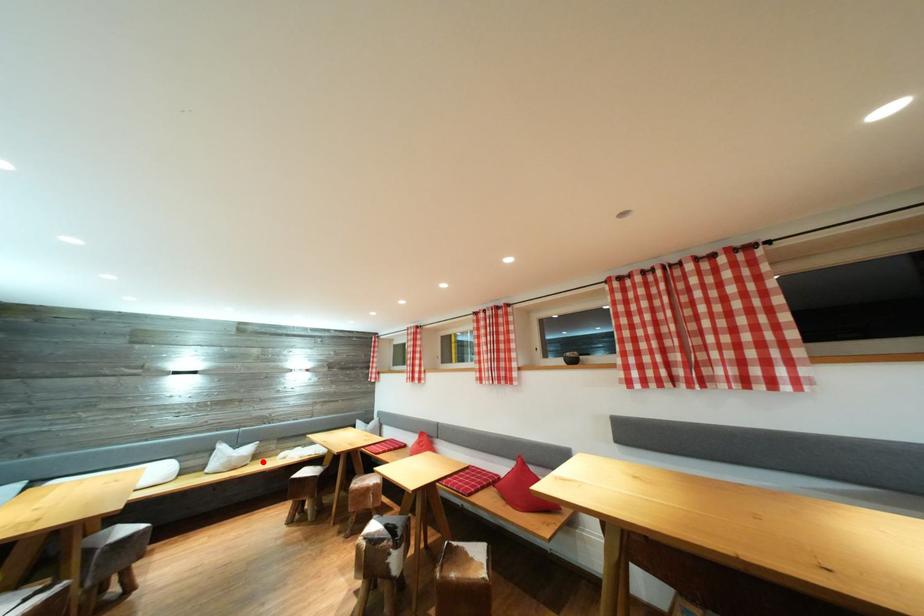
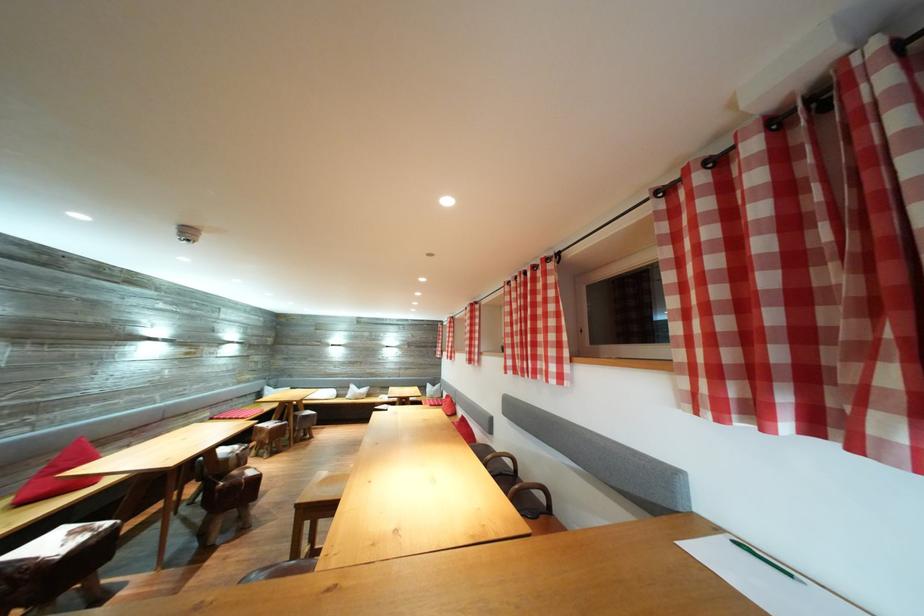
Find the pixel in the second image that matches the highlighted location in the first image.

(375, 400)